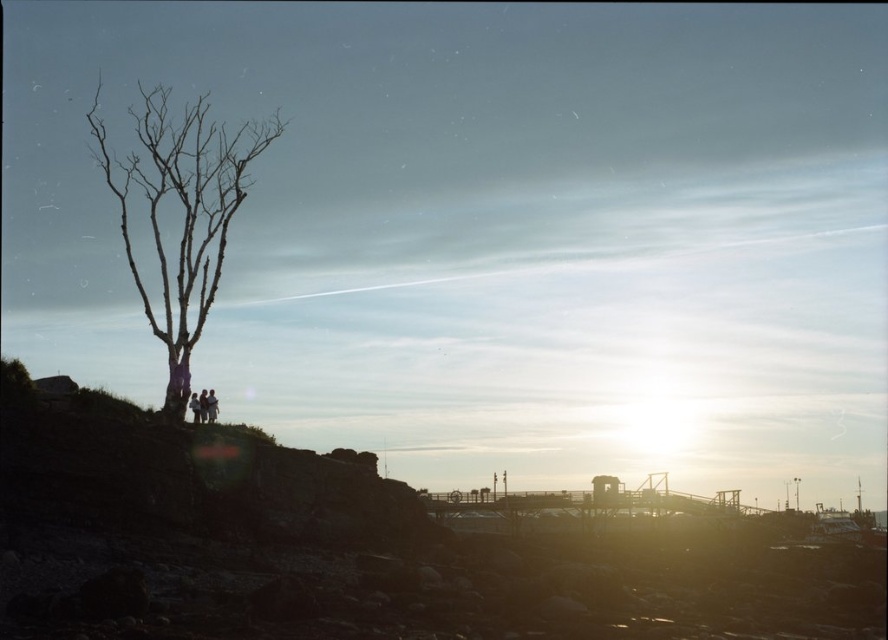
Question: Where is dull brown rock at left located in relation to silhouette clothing at left in the image?

Choices:
 (A) right
 (B) left

Answer: (A)

Question: Which is nearer to the silhouette figure at left?

Choices:
 (A) silhouette clothing at left
 (B) dull brown rock at left
 (C) dark clothing figure at left
 (D) bare wood tree at left

Answer: (C)

Question: Observing the image, what is the correct spatial positioning of bare wood tree at left in reference to dark clothing figure at left?

Choices:
 (A) left
 (B) right

Answer: (A)

Question: Which of the following is the farthest from the observer?

Choices:
 (A) dark clothing figure at left
 (B) dull brown rock at left

Answer: (A)

Question: Which object is positioned farthest from the dark clothing figure at left?

Choices:
 (A) silhouette figure at left
 (B) bare wood tree at left
 (C) silhouette clothing at left
 (D) dull brown rock at left

Answer: (D)

Question: Can you confirm if dull brown rock at left is thinner than dark clothing figure at left?

Choices:
 (A) yes
 (B) no

Answer: (B)